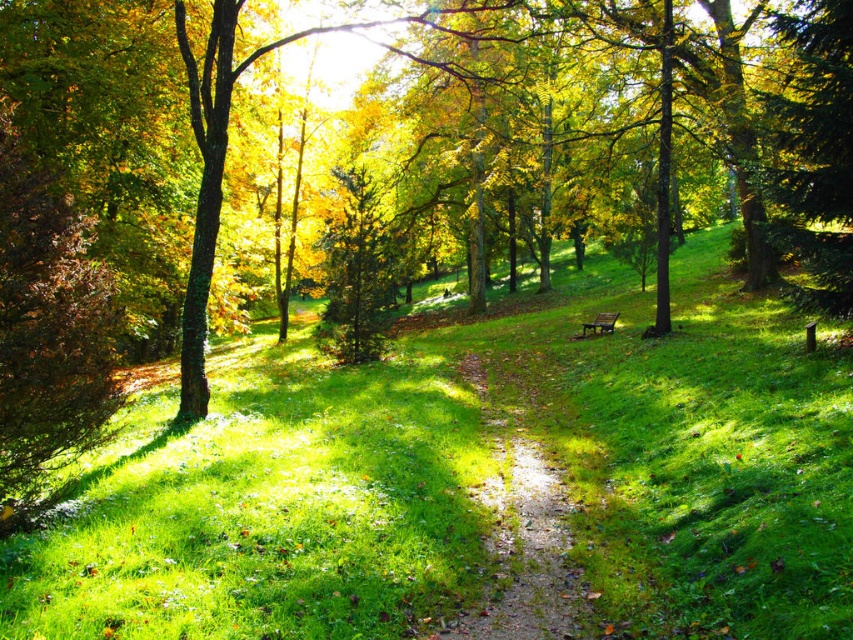
Is green grassy at center bigger than dirt path at center?

Indeed, green grassy at center has a larger size compared to dirt path at center.

Can you confirm if green grassy at center is positioned above dirt path at center?

Correct, green grassy at center is located above dirt path at center.

Is point (732, 611) farther from viewer compared to point (544, 470)?

No, (732, 611) is in front of (544, 470).

This screenshot has width=853, height=640. I want to click on green grassy at center, so click(474, 477).

Between green grassy at center and wooden park bench at center, which one is positioned lower?

green grassy at center

Does point (735, 502) lie behind point (601, 332)?

That is False.

Which is behind, point (825, 531) or point (605, 323)?

The point (605, 323) is behind.

The height and width of the screenshot is (640, 853). What are the coordinates of `green grassy at center` in the screenshot? It's located at (474, 477).

Which is more to the left, dirt path at center or wooden park bench at center?

dirt path at center

Is dirt path at center shorter than wooden park bench at center?

Indeed, dirt path at center has a lesser height compared to wooden park bench at center.

Locate an element on the screen. dirt path at center is located at coordinates (x=526, y=554).